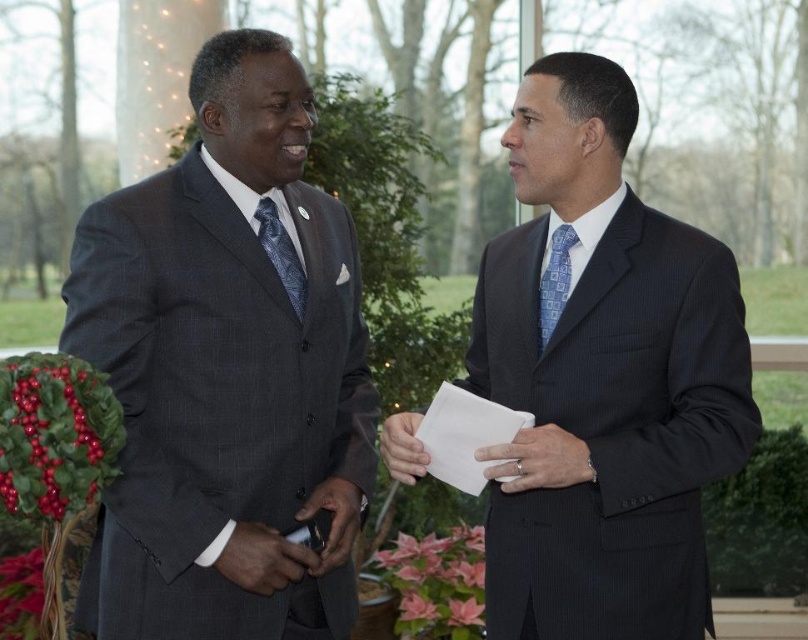
You are standing in the formal setting shown in the image. There is a point at coordinates (606, 378). What object is located at that point?

The point at coordinates (606, 378) corresponds to the dark pinstripe suit at center.

You are a photographer standing in front of the two men. You want to take a photo of the white paper at center without the blue textured tie at right blocking the view. Is this possible?

The white paper at center is behind the blue textured tie at right, so it is currently blocked by the tie. To capture the paper without obstruction, you would need to adjust your angle or have the man move so the tie no longer obscures the paper.